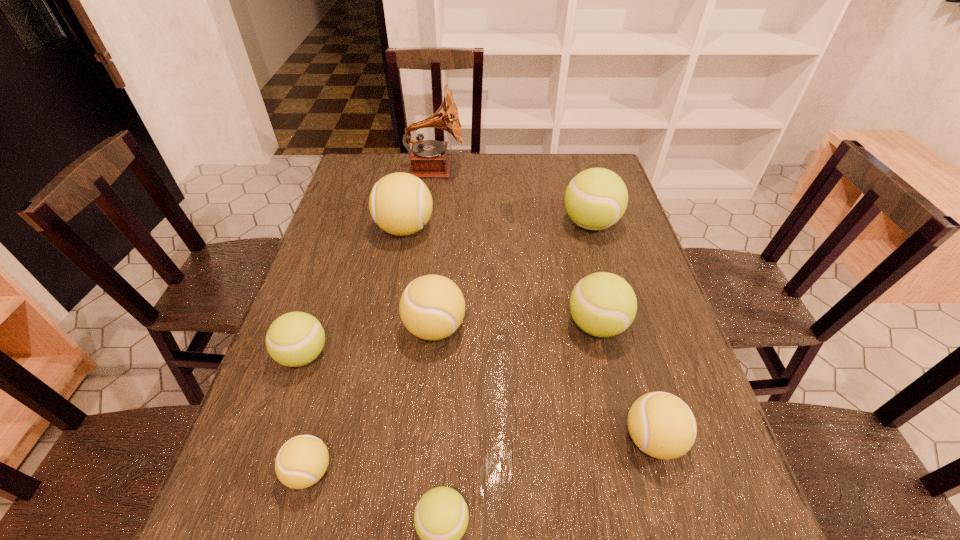
In the image, there is a desktop. Identify the location of free space at the right edge. (658, 373).

Identify the location of vacant region at the far left corner. Image resolution: width=960 pixels, height=540 pixels. (346, 184).

Find the location of a particular element. Image resolution: width=960 pixels, height=540 pixels. vacant space at the far right corner is located at coordinates pyautogui.click(x=576, y=168).

Where is `vacant region at the near right corner`? vacant region at the near right corner is located at coordinates (659, 519).

Where is `vacant area that lies between the second biggest green tennis ball and the rightmost yellow tennis ball`? The height and width of the screenshot is (540, 960). vacant area that lies between the second biggest green tennis ball and the rightmost yellow tennis ball is located at coordinates (625, 382).

At what (x,y) coordinates should I click in order to perform the action: click on empty space that is in between the tallest object and the second biggest green tennis ball. Please return your answer as a coordinate pair (x, y). This screenshot has width=960, height=540. Looking at the image, I should click on (516, 247).

Locate an element on the screen. This screenshot has height=540, width=960. free space between the rightmost yellow tennis ball and the farthest yellow tennis ball is located at coordinates (529, 334).

Identify the location of unoccupied position between the third smallest green tennis ball and the farthest object. The height and width of the screenshot is (540, 960). [516, 247].

Identify the location of vacant space that's between the smallest yellow tennis ball and the biggest green tennis ball. (449, 348).

Identify which object is located as the fourth nearest to the third biggest yellow tennis ball. Please provide its 2D coordinates. Your answer should be formatted as a tuple, i.e. [(x, y)], where the tuple contains the x and y coordinates of a point satisfying the conditions above.

[(595, 199)]